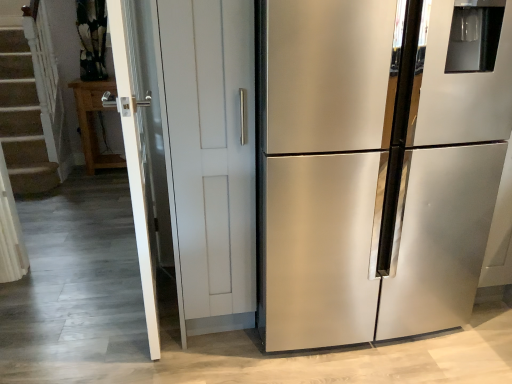
Question: Does wooden cabinet at left have a lesser width compared to stainless steel refrigerator at right?

Choices:
 (A) yes
 (B) no

Answer: (A)

Question: Can you see wooden cabinet at left touching stainless steel refrigerator at right?

Choices:
 (A) no
 (B) yes

Answer: (A)

Question: Does wooden cabinet at left have a larger size compared to stainless steel refrigerator at right?

Choices:
 (A) yes
 (B) no

Answer: (B)

Question: Is wooden cabinet at left closer to the viewer compared to stainless steel refrigerator at right?

Choices:
 (A) yes
 (B) no

Answer: (B)

Question: Does wooden cabinet at left have a greater height compared to stainless steel refrigerator at right?

Choices:
 (A) no
 (B) yes

Answer: (A)

Question: Is wooden cabinet at left not close to stainless steel refrigerator at right?

Choices:
 (A) yes
 (B) no

Answer: (A)

Question: Could you tell me if white glossy screen door at left is facing wooden cabinet at left?

Choices:
 (A) no
 (B) yes

Answer: (A)

Question: Is white glossy screen door at left turned away from wooden cabinet at left?

Choices:
 (A) no
 (B) yes

Answer: (A)

Question: Is white glossy screen door at left thinner than wooden cabinet at left?

Choices:
 (A) yes
 (B) no

Answer: (A)

Question: From a real-world perspective, is white glossy screen door at left beneath wooden cabinet at left?

Choices:
 (A) yes
 (B) no

Answer: (B)

Question: Can you confirm if white glossy screen door at left is shorter than wooden cabinet at left?

Choices:
 (A) no
 (B) yes

Answer: (A)

Question: Does white glossy screen door at left have a smaller size compared to wooden cabinet at left?

Choices:
 (A) yes
 (B) no

Answer: (B)

Question: Is stainless steel refrigerator at right touching white glossy screen door at left?

Choices:
 (A) no
 (B) yes

Answer: (A)